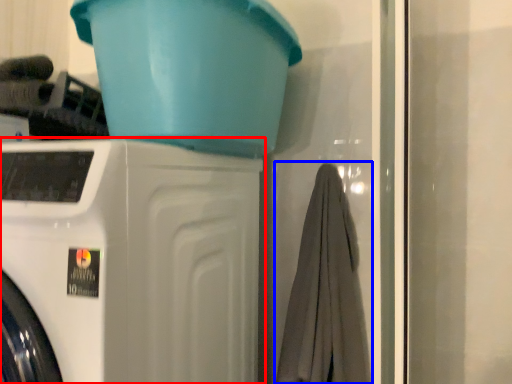
Question: Which object appears closest to the camera in this image, washing machine (highlighted by a red box) or bath towel (highlighted by a blue box)?

Choices:
 (A) washing machine
 (B) bath towel

Answer: (A)